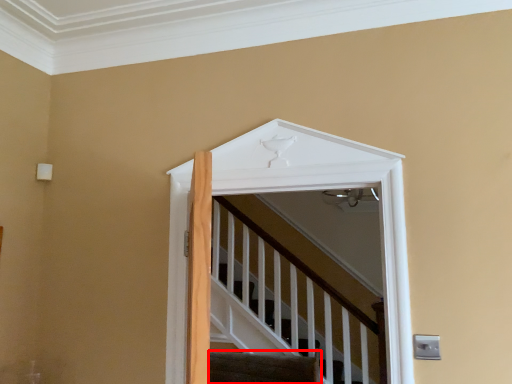
Question: From the image's perspective, considering the relative positions of stairs (annotated by the red box) and elevator in the image provided, where is stairs (annotated by the red box) located with respect to the staircase?

Choices:
 (A) below
 (B) above

Answer: (A)